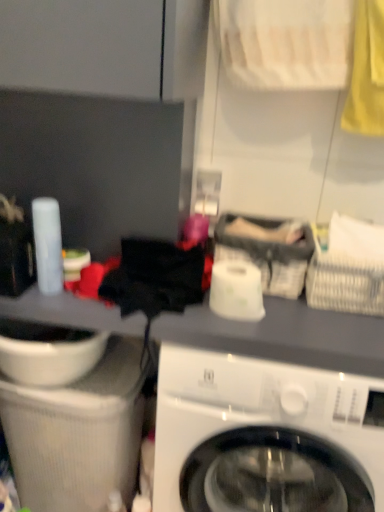
Where is `vacant area in front of white woven basket at upper right, the 2th basket from the left`? The width and height of the screenshot is (384, 512). vacant area in front of white woven basket at upper right, the 2th basket from the left is located at coordinates (339, 330).